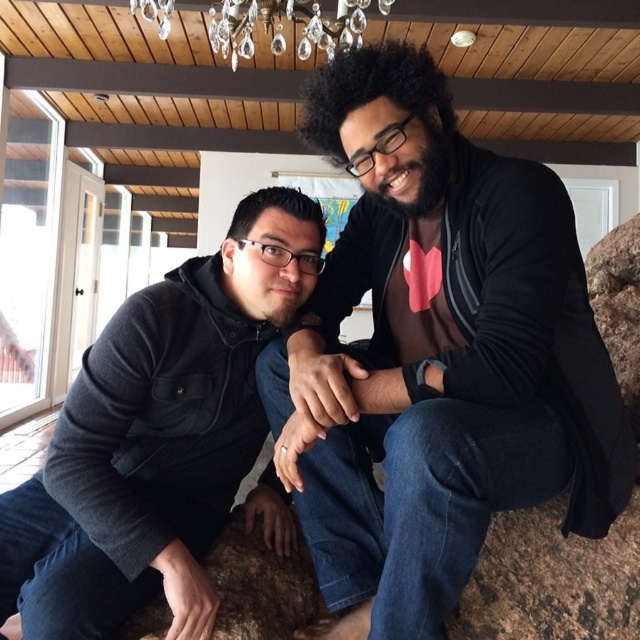
You are a photographer setting up a shoot in this room. You need to position a light stand that is 1.2 meters tall. The light stand must be placed between the black matte jacket at center and the crystal glass chandelier at upper center. Is there enough vertical space between them for the light stand?

The black matte jacket at center is below the crystal glass chandelier at upper center, so there is sufficient vertical space between them to accommodate a 1.2 meter tall light stand.

In the scene shown: You are a photographer setting up for a group photo. You see the dark gray hoodie at left and the crystal glass chandelier at upper center. Which object is closer to the left side of the frame?

The dark gray hoodie at left is positioned on the right side of the crystal glass chandelier at upper center, meaning the chandelier is closer to the left side of the frame.

You are a photographer setting up a shot of two people. You notice the black matte jacket at center and the dark gray hoodie at left. Which clothing item is positioned higher in the frame?

The black matte jacket at center is much taller as dark gray hoodie at left, so it is positioned higher in the frame.